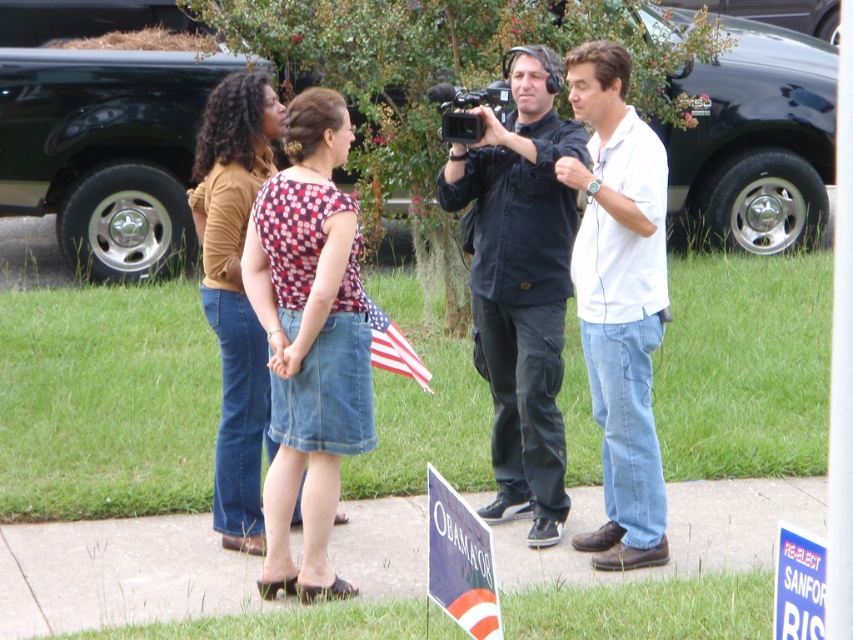
Question: In this image, where is denim skirt at center located relative to black plastic video camera at center?

Choices:
 (A) below
 (B) above

Answer: (A)

Question: Among these objects, which one is farthest from the camera?

Choices:
 (A) black shirt at center
 (B) american flag at center

Answer: (A)

Question: Can you confirm if denim skirt at center is positioned below black plastic video camera at center?

Choices:
 (A) yes
 (B) no

Answer: (A)

Question: Is black plastic video camera at center to the left of american flag at center from the viewer's perspective?

Choices:
 (A) no
 (B) yes

Answer: (A)

Question: Among these objects, which one is farthest from the camera?

Choices:
 (A) white cotton shirt at center
 (B) american flag at center
 (C) denim skirt at center
 (D) black shirt at center

Answer: (D)

Question: Which object is the farthest from the denim skirt at center?

Choices:
 (A) white cotton shirt at center
 (B) black shirt at center
 (C) black plastic video camera at center
 (D) american flag at center

Answer: (A)